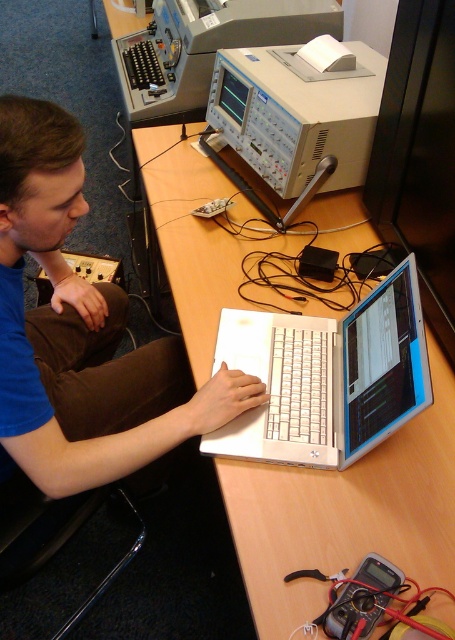
Question: Which of these objects is positioned farthest from the white plastic laptop at center?

Choices:
 (A) blue fabric shirt at left
 (B) brown corduroy pants at lower left

Answer: (B)

Question: Does white plastic laptop at center have a smaller size compared to gray plastic oscilloscope at upper center?

Choices:
 (A) yes
 (B) no

Answer: (A)

Question: Estimate the real-world distances between objects in this image. Which object is farther from the white plastic oscilloscope at upper center?

Choices:
 (A) white plastic laptop at center
 (B) brown corduroy pants at lower left
 (C) blue fabric shirt at left
 (D) gray plastic oscilloscope at upper center

Answer: (C)

Question: Is white plastic laptop at center positioned at the back of gray plastic oscilloscope at upper center?

Choices:
 (A) yes
 (B) no

Answer: (B)

Question: Estimate the real-world distances between objects in this image. Which object is closer to the white plastic laptop at center?

Choices:
 (A) brown corduroy pants at lower left
 (B) white plastic oscilloscope at upper center
 (C) blue fabric shirt at left

Answer: (C)

Question: Is blue fabric shirt at left further to the viewer compared to white plastic laptop at center?

Choices:
 (A) no
 (B) yes

Answer: (B)